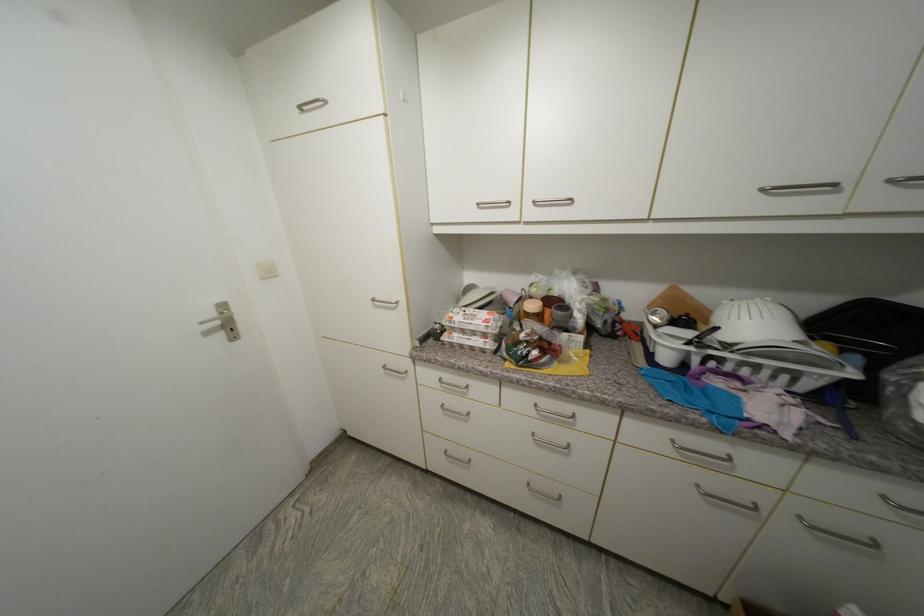
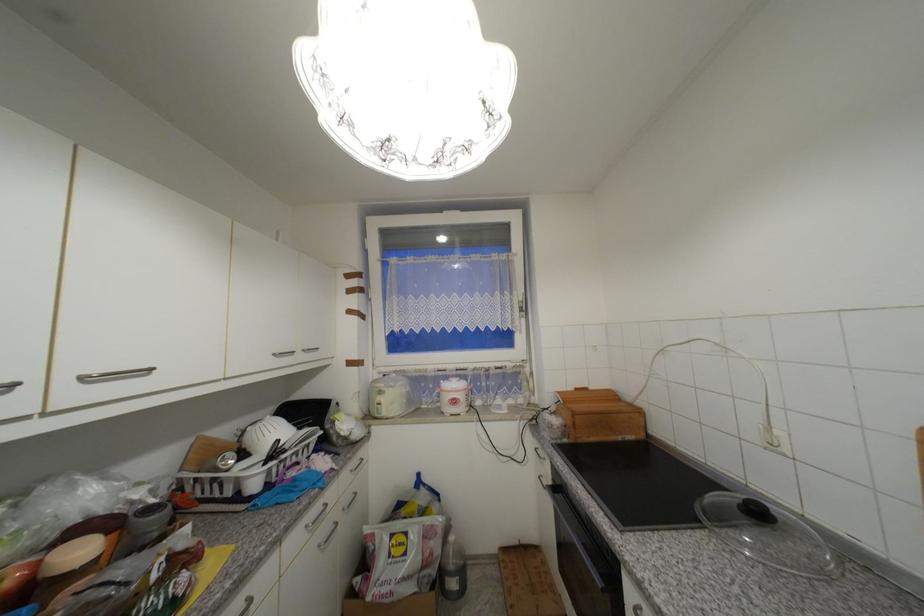
Locate, in the second image, the point that corresponds to point (761, 369) in the first image.

(301, 454)